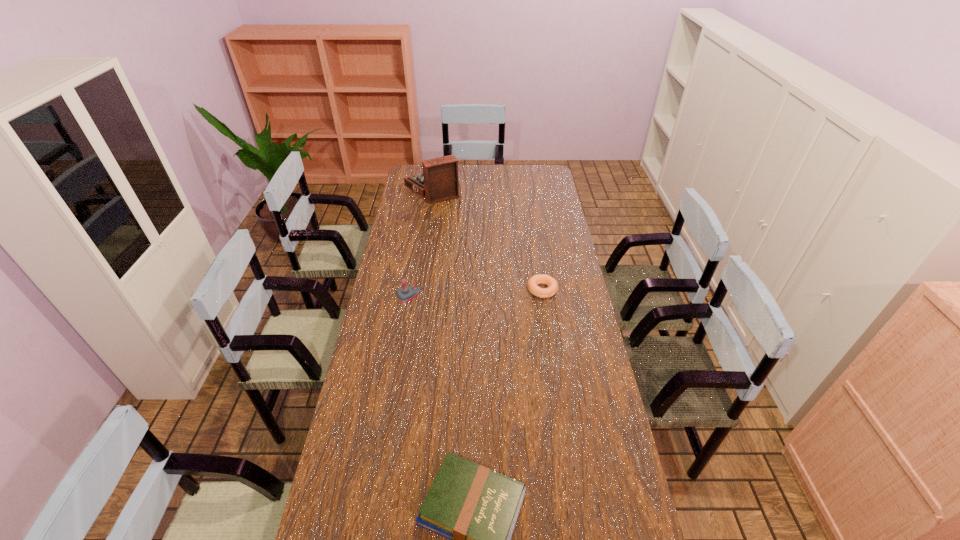
Locate an element on the screen. Image resolution: width=960 pixels, height=540 pixels. the tallest object is located at coordinates (438, 182).

Where is `the farthest object`? The width and height of the screenshot is (960, 540). the farthest object is located at coordinates (438, 182).

The width and height of the screenshot is (960, 540). What are the coordinates of `joystick` in the screenshot? It's located at (405, 294).

What are the coordinates of `the shortest object` in the screenshot? It's located at (535, 280).

This screenshot has height=540, width=960. I want to click on the rightmost object, so click(x=535, y=280).

You are a GUI agent. You are given a task and a screenshot of the screen. Output one action in this format:
    pyautogui.click(x=<x>, y=<y>)
    Task: Click on the blank space located on the right of the farthest object
    
    Given the screenshot: What is the action you would take?
    pyautogui.click(x=523, y=189)

Identify the location of free space located 0.190m on the front of the joystick. (420, 343).

Locate an element on the screen. This screenshot has width=960, height=540. vacant point located 0.130m on the front of the bagel is located at coordinates (548, 326).

The image size is (960, 540). I want to click on object situated at the far edge, so click(438, 182).

Locate an element on the screen. phonograph record that is at the left edge is located at coordinates (438, 182).